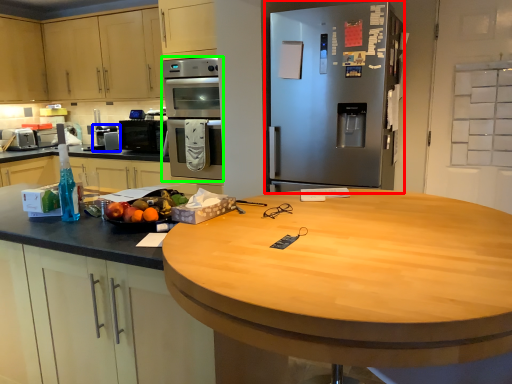
Question: Based on their relative distances, which object is farther from refrigerator (highlighted by a red box)? Choose from appliance (highlighted by a blue box) and oven (highlighted by a green box).

Choices:
 (A) appliance
 (B) oven

Answer: (A)